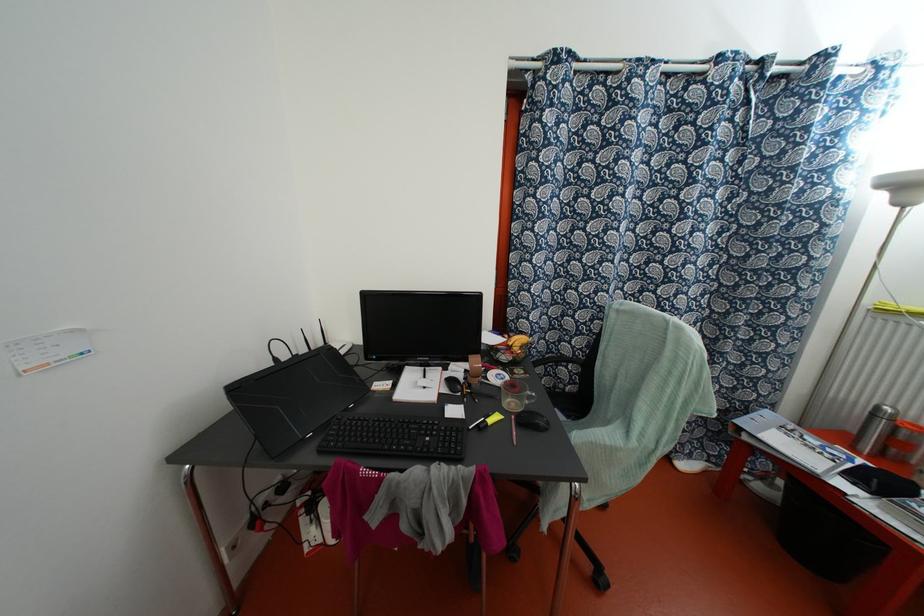
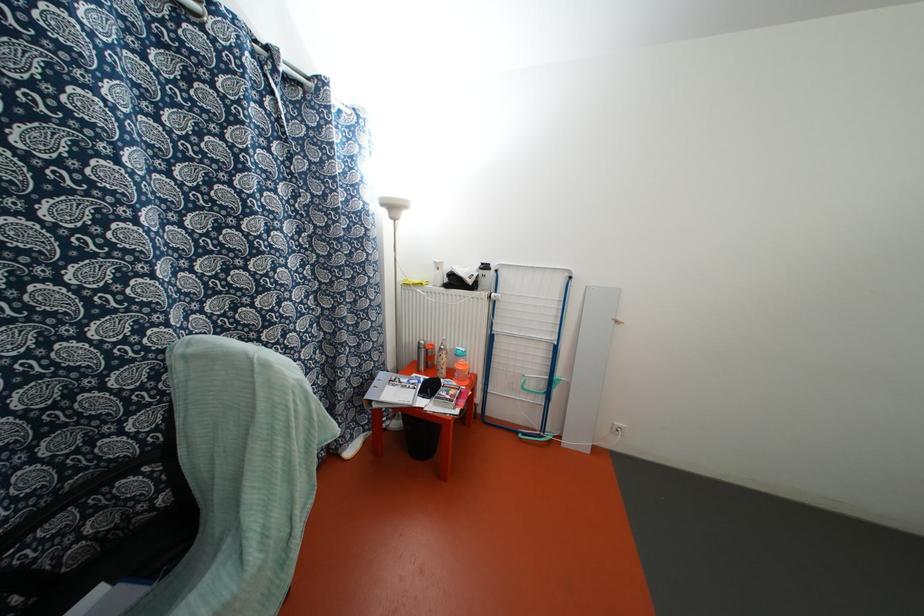
Question: The images are taken continuously from a first-person perspective. In which direction is your viewpoint rotating?

Choices:
 (A) Left
 (B) Right
 (C) Up
 (D) Down

Answer: (B)